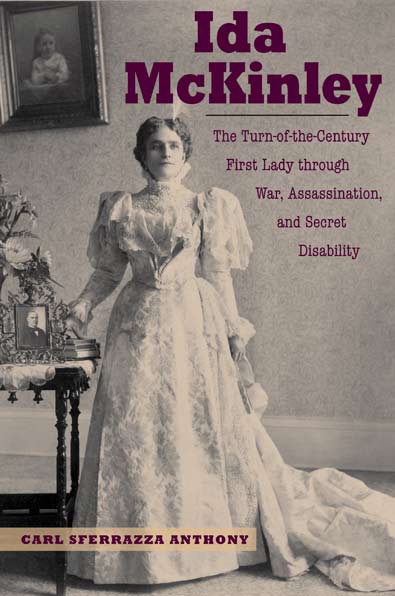
This screenshot has width=395, height=596. In order to click on right rear table leg in this screenshot , I will do `click(74, 445)`.